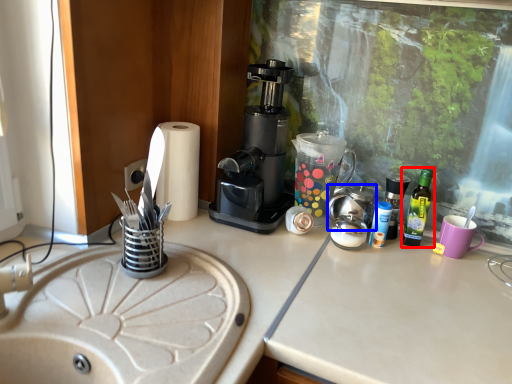
Question: Which point is closer to the camera, bottle (highlighted by a red box) or appliance (highlighted by a blue box)?

Choices:
 (A) bottle
 (B) appliance

Answer: (B)